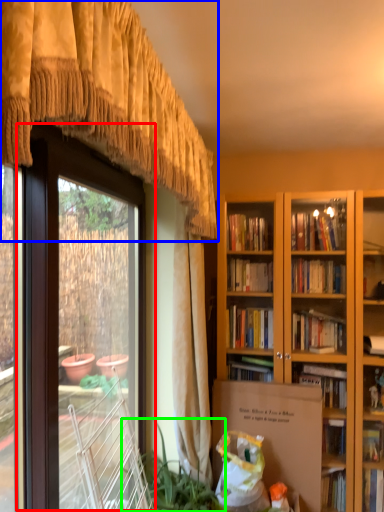
Question: Which object is the closest to the screen door (highlighted by a red box)? Choose among these: curtain (highlighted by a blue box) or houseplant (highlighted by a green box).

Choices:
 (A) curtain
 (B) houseplant

Answer: (A)